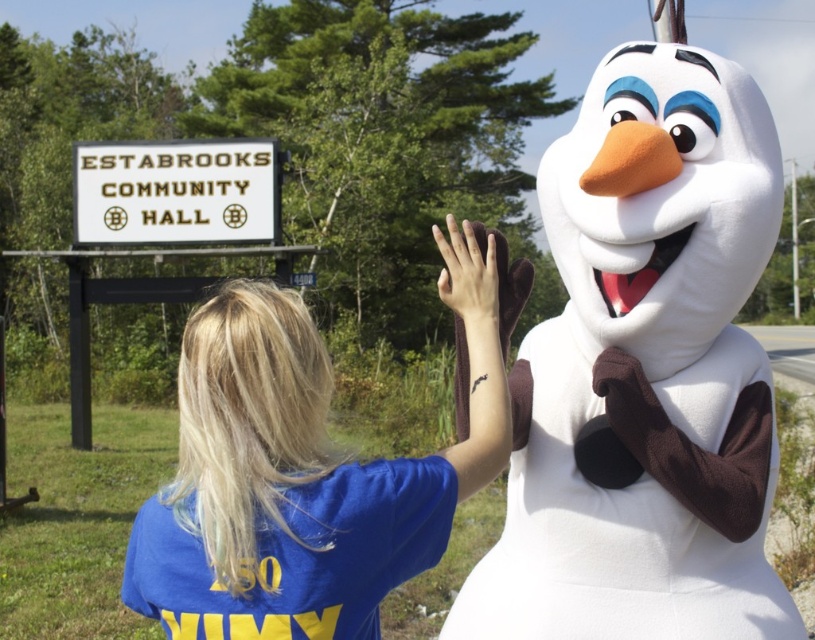
Question: Does white plush snowman at center have a larger size compared to blue cotton shirt at center?

Choices:
 (A) no
 (B) yes

Answer: (B)

Question: Which point is closer to the camera taking this photo?

Choices:
 (A) (166, 637)
 (B) (628, 637)

Answer: (A)

Question: Does white plush snowman at center have a greater width compared to blue cotton shirt at center?

Choices:
 (A) yes
 (B) no

Answer: (A)

Question: Does white plush snowman at center have a larger size compared to blue cotton shirt at center?

Choices:
 (A) yes
 (B) no

Answer: (A)

Question: Which point appears farthest from the camera in this image?

Choices:
 (A) (278, 547)
 (B) (584, 218)

Answer: (B)